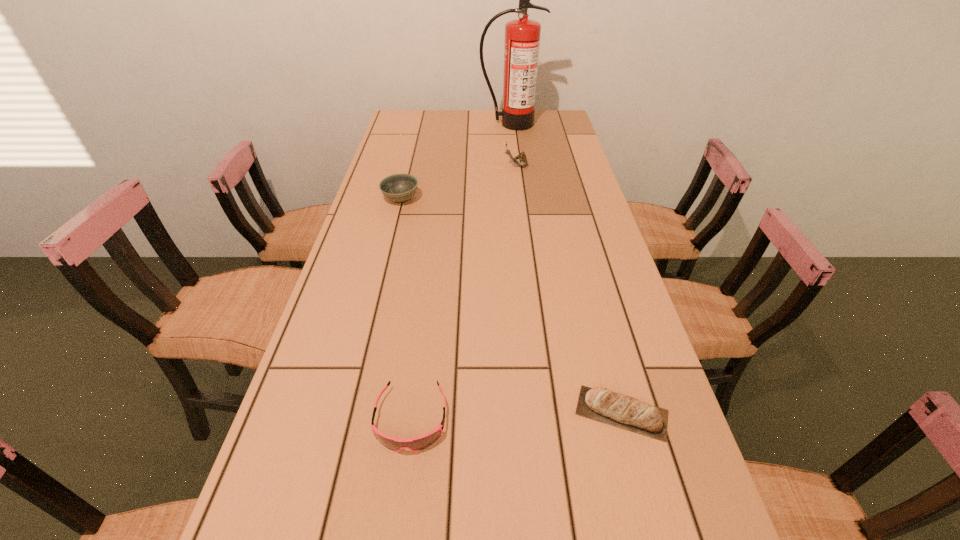
Identify the location of free space at the far edge of the desktop. (462, 130).

Find the location of `vacant space at the left edge of the desktop`. vacant space at the left edge of the desktop is located at coordinates (344, 470).

In the image, there is a desktop. Where is `free space at the right edge`? The height and width of the screenshot is (540, 960). free space at the right edge is located at coordinates (574, 205).

You are a GUI agent. You are given a task and a screenshot of the screen. Output one action in this format:
    pyautogui.click(x=<x>, y=<y>)
    Task: Click on the blank space at the far left corner of the desktop
    The image size is (960, 540).
    Given the screenshot: What is the action you would take?
    pyautogui.click(x=397, y=127)

This screenshot has height=540, width=960. I want to click on free space at the far right corner, so click(562, 117).

Identify the location of vacant space that's between the second farthest object and the third shortest object. (459, 183).

The image size is (960, 540). I want to click on vacant region between the bowl and the snail, so click(459, 183).

Where is `free space that is in between the goggles and the snail`? free space that is in between the goggles and the snail is located at coordinates (464, 293).

Where is `blank region between the second farthest object and the goggles`? blank region between the second farthest object and the goggles is located at coordinates (464, 293).

The image size is (960, 540). Find the location of `empty space that is in between the bowl and the fire extinguisher`. empty space that is in between the bowl and the fire extinguisher is located at coordinates (456, 161).